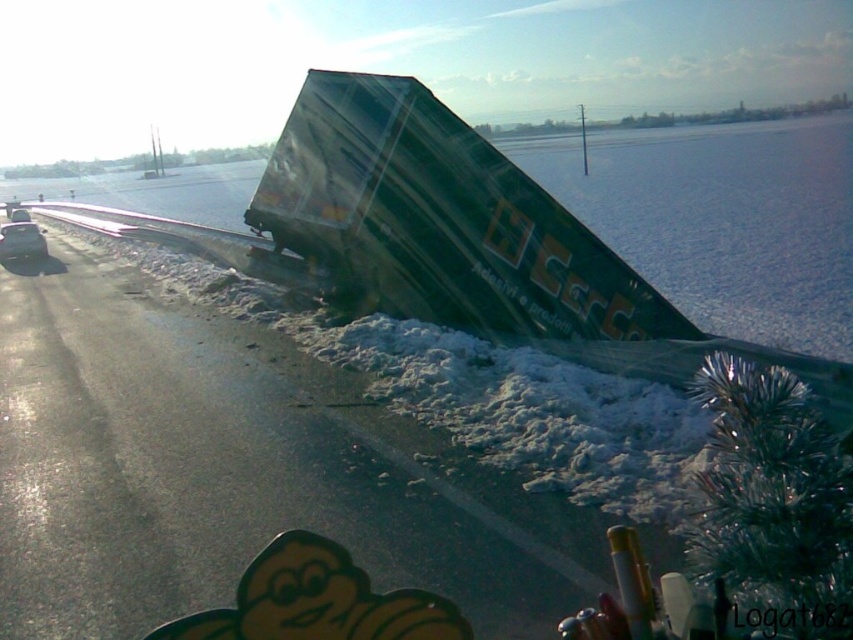
Question: Is green plastic truck at upper right above metallic silver car at left?

Choices:
 (A) yes
 (B) no

Answer: (B)

Question: Which of the following is the closest to the observer?

Choices:
 (A) green glossy trailer truck at center
 (B) green plastic truck at upper right
 (C) shiny silver car at left

Answer: (B)

Question: Which of the following is the farthest from the observer?

Choices:
 (A) (426, 513)
 (B) (18, 214)
 (C) (254, 221)
 (D) (15, 221)

Answer: (B)

Question: Which object appears farthest from the camera in this image?

Choices:
 (A) green plastic truck at upper right
 (B) shiny silver car at left
 (C) metallic silver car at left
 (D) green glossy trailer truck at center

Answer: (C)

Question: Is green glossy trailer truck at center below metallic silver car at left?

Choices:
 (A) yes
 (B) no

Answer: (A)

Question: Is green glossy trailer truck at center thinner than shiny silver car at left?

Choices:
 (A) no
 (B) yes

Answer: (A)